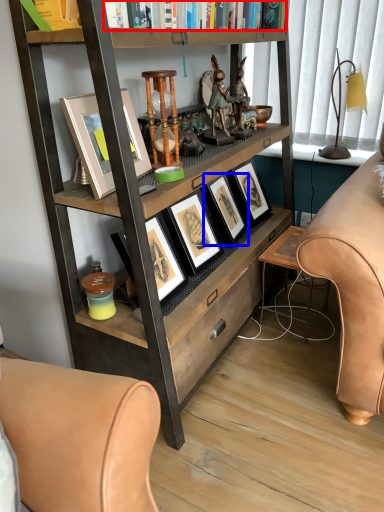
Question: Which of the following is the farthest to the observer, book (highlighted by a red box) or picture frame (highlighted by a blue box)?

Choices:
 (A) book
 (B) picture frame

Answer: (B)